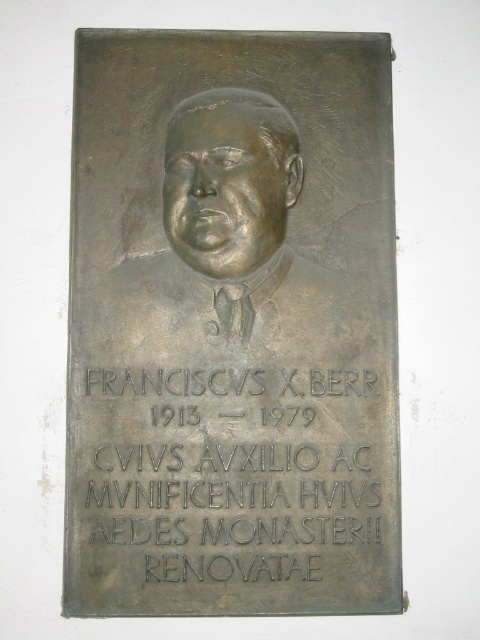
Question: From the image, what is the correct spatial relationship of bronze relief at center in relation to bronze relief bust at center?

Choices:
 (A) left
 (B) right

Answer: (B)

Question: Which of the following is the farthest from the observer?

Choices:
 (A) bronze engraving at center
 (B) bronze relief bust at center

Answer: (A)

Question: Which of these objects is positioned closest to the bronze engraving at center?

Choices:
 (A) bronze relief at center
 (B) bronze relief bust at center

Answer: (A)

Question: Is bronze engraving at center above bronze relief bust at center?

Choices:
 (A) yes
 (B) no

Answer: (B)

Question: Which object is the closest to the bronze engraving at center?

Choices:
 (A) bronze relief bust at center
 (B) bronze relief at center

Answer: (B)

Question: Is the position of bronze relief at center more distant than that of bronze engraving at center?

Choices:
 (A) yes
 (B) no

Answer: (B)